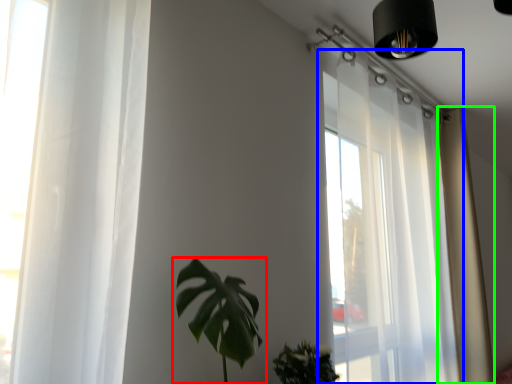
Question: Which object is positioned farthest from houseplant (highlighted by a red box)? Select from window (highlighted by a blue box) and curtain (highlighted by a green box).

Choices:
 (A) window
 (B) curtain

Answer: (B)